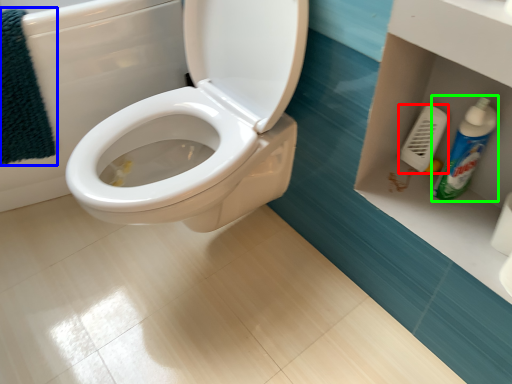
Question: Considering the real-world distances, which object is closest to towel bar (highlighted by a red box)? bath towel (highlighted by a blue box) or cleaning product (highlighted by a green box).

Choices:
 (A) bath towel
 (B) cleaning product

Answer: (B)